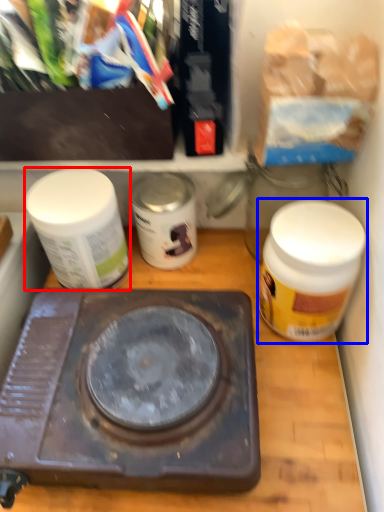
Question: Which object appears farthest to the camera in this image, bottle (highlighted by a red box) or bottle (highlighted by a blue box)?

Choices:
 (A) bottle
 (B) bottle

Answer: (A)